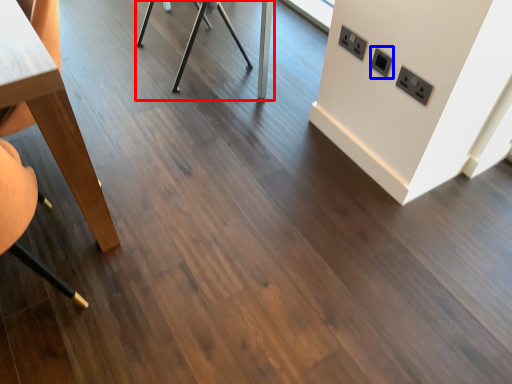
Question: Which of the following is the farthest to the observer, table (highlighted by a red box) or electric outlet (highlighted by a blue box)?

Choices:
 (A) table
 (B) electric outlet

Answer: (A)